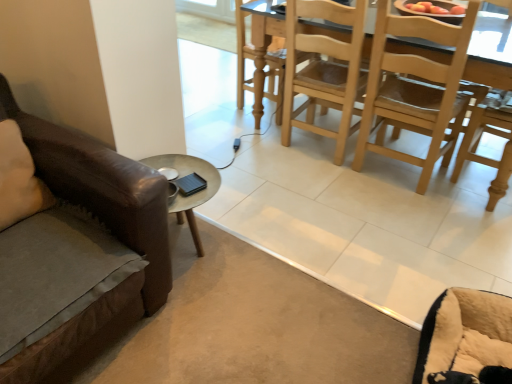
Question: Is light brown wood chair at center a part of beige plush swivel chair at lower right?

Choices:
 (A) yes
 (B) no

Answer: (B)

Question: Is beige plush swivel chair at lower right at the left side of light brown wood chair at center?

Choices:
 (A) yes
 (B) no

Answer: (B)

Question: Does beige plush swivel chair at lower right have a greater width compared to light brown wood chair at center?

Choices:
 (A) yes
 (B) no

Answer: (B)

Question: Does beige plush swivel chair at lower right have a lesser height compared to light brown wood chair at center?

Choices:
 (A) yes
 (B) no

Answer: (A)

Question: Does beige plush swivel chair at lower right have a greater height compared to light brown wood chair at center?

Choices:
 (A) yes
 (B) no

Answer: (B)

Question: From a real-world perspective, is beige plush swivel chair at lower right physically above light brown wood chair at center?

Choices:
 (A) no
 (B) yes

Answer: (A)

Question: Considering the relative positions of beige plush swivel chair at lower right and light brown wooden table at upper right in the image provided, is beige plush swivel chair at lower right behind light brown wooden table at upper right?

Choices:
 (A) yes
 (B) no

Answer: (B)

Question: Is beige plush swivel chair at lower right not within light brown wooden table at upper right?

Choices:
 (A) yes
 (B) no

Answer: (A)

Question: Is beige plush swivel chair at lower right touching light brown wooden table at upper right?

Choices:
 (A) no
 (B) yes

Answer: (A)

Question: From the image's perspective, is beige plush swivel chair at lower right beneath light brown wooden table at upper right?

Choices:
 (A) yes
 (B) no

Answer: (A)

Question: From a real-world perspective, is beige plush swivel chair at lower right located higher than light brown wooden table at upper right?

Choices:
 (A) yes
 (B) no

Answer: (B)

Question: Does beige plush swivel chair at lower right have a greater height compared to light brown wooden table at upper right?

Choices:
 (A) no
 (B) yes

Answer: (A)

Question: Does beige fabric pillow at left have a lesser height compared to light brown wood chair at center?

Choices:
 (A) no
 (B) yes

Answer: (B)